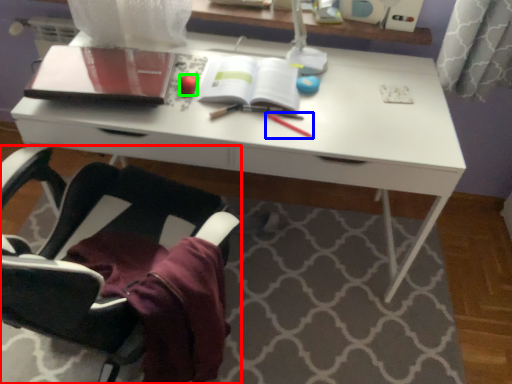
Question: Estimate the real-world distances between objects in this image. Which object is farther from chair (highlighted by a red box), stationery (highlighted by a blue box) or stationery (highlighted by a green box)?

Choices:
 (A) stationery
 (B) stationery

Answer: (A)